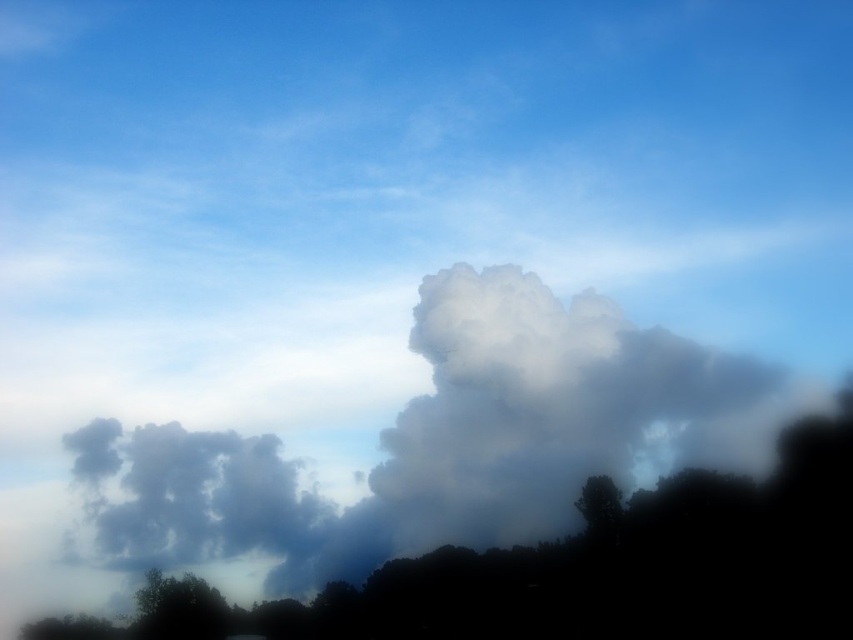
Question: Which point appears farthest from the camera in this image?

Choices:
 (A) (138, 433)
 (B) (587, 497)
 (C) (190, 634)

Answer: (A)

Question: Among these objects, which one is farthest from the camera?

Choices:
 (A) green leafy tree at lower left
 (B) white fluffy cloud at center

Answer: (A)

Question: Can you confirm if green leafy tree at lower left is positioned to the right of green matte tree at lower right?

Choices:
 (A) yes
 (B) no

Answer: (B)

Question: Can you confirm if white fluffy cloud at center is positioned below green matte tree at lower right?

Choices:
 (A) no
 (B) yes

Answer: (B)

Question: Which object is farther from the camera taking this photo?

Choices:
 (A) green leafy tree at lower left
 (B) green matte tree at lower right

Answer: (A)

Question: Can you confirm if green leafy tree at lower left is positioned to the left of green matte tree at lower right?

Choices:
 (A) yes
 (B) no

Answer: (A)